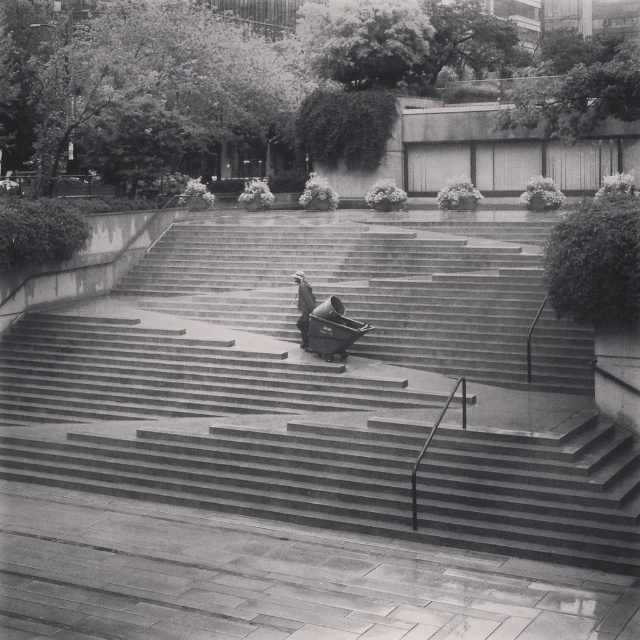
Looking at this image, you are standing at the bottom of the stairs in the image. You see the concrete stairs at center located at point (328,392). If you want to reach the person walking at the top, which direction should you move towards?

You should move towards the point (328,392) where the concrete stairs at center are located to reach the person at the top.

You are standing at the bottom of the concrete stairs at center and want to approach the dark gray fabric coat at center. In which direction should you walk to reach it?

The concrete stairs at center is to the left of dark gray fabric coat at center. Therefore, to reach the dark gray fabric coat at center, you should walk to the right.

You are standing at the bottom of the concrete stairs at center and want to reach the person wearing the dark gray fabric coat at center at the top. How does the height of the stairs compare to the person?

The concrete stairs at center is taller than the dark gray fabric coat at center, so the stairs are taller than the person wearing the dark gray fabric coat at center.